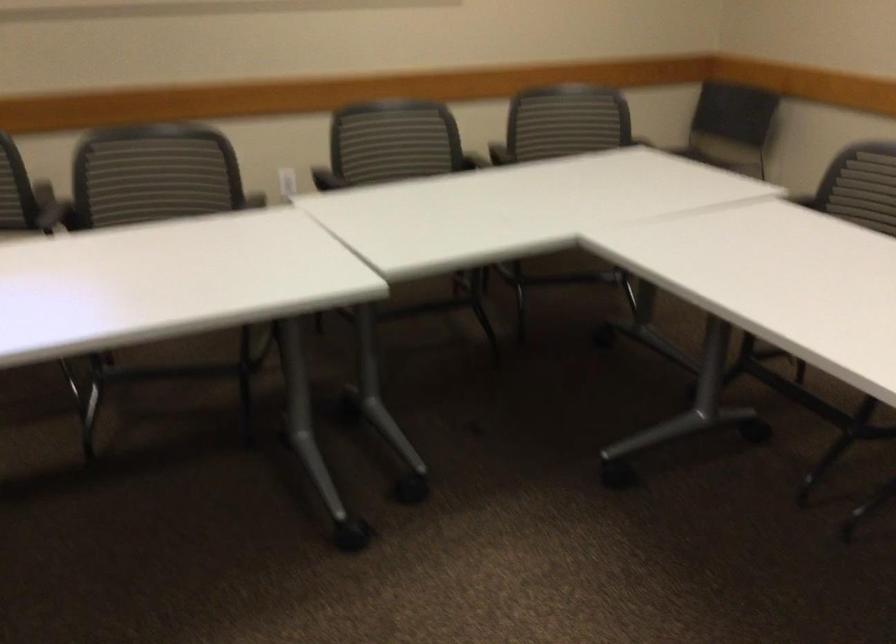
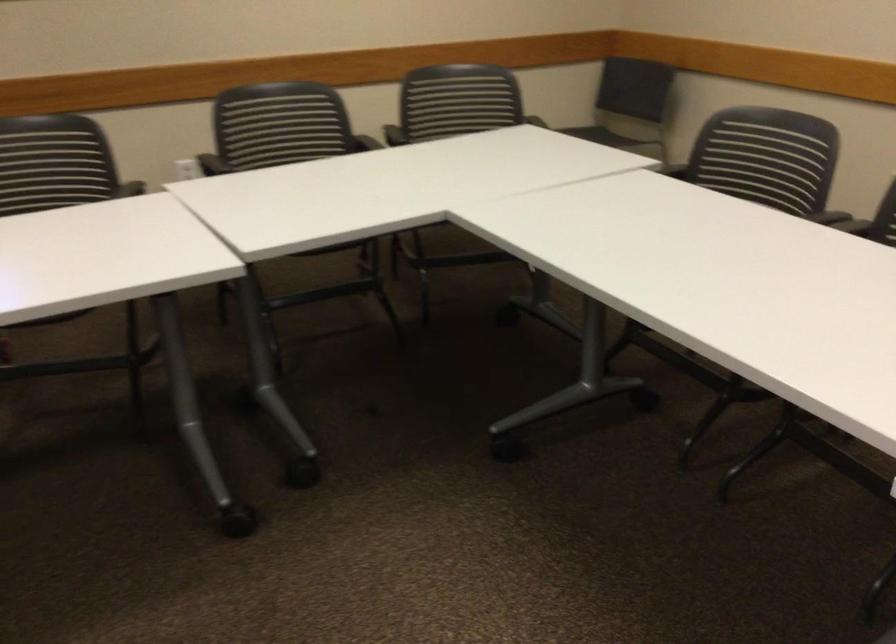
Find the pixel in the second image that matches [634,131] in the first image.

(529, 113)